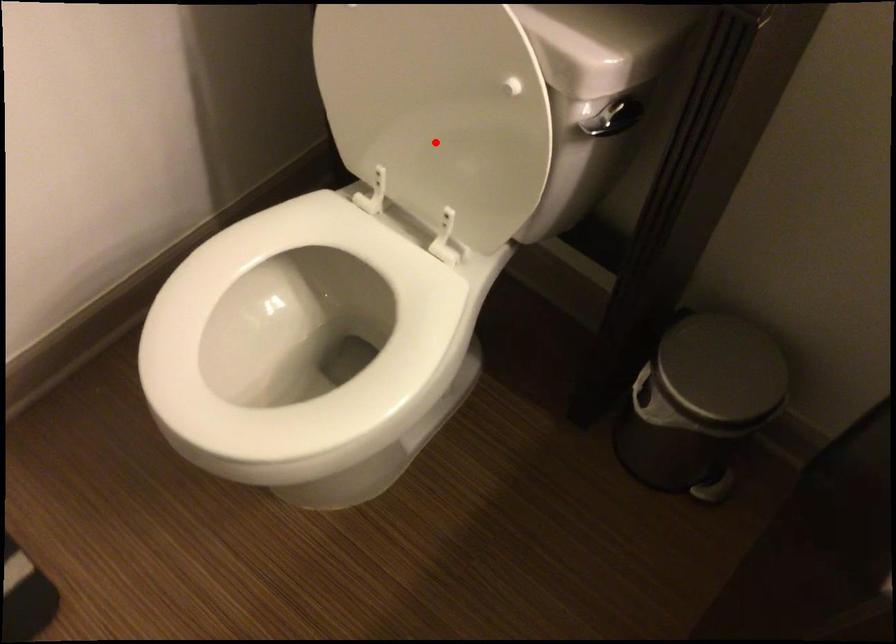
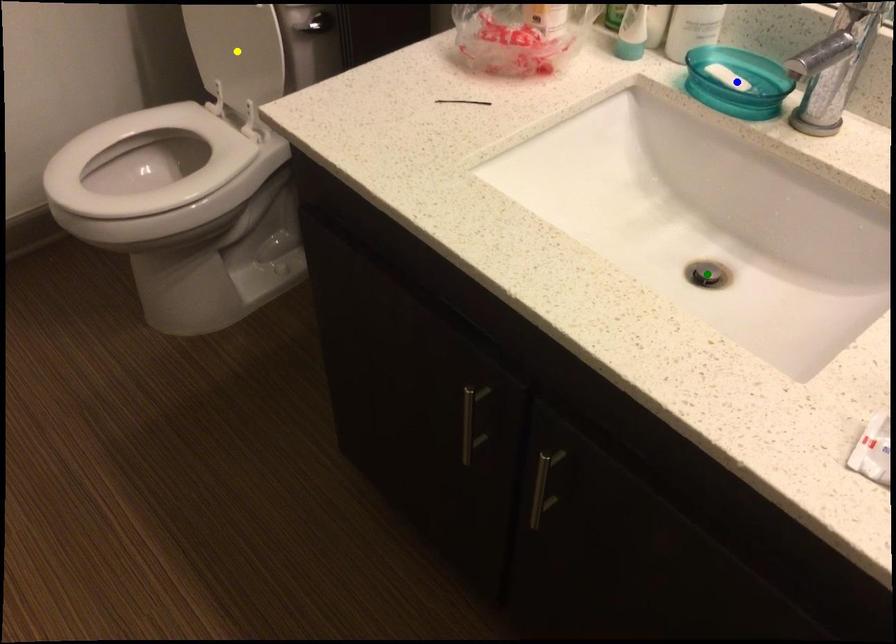
Question: I am providing you with two images of the same scene from different viewpoints. A red point is marked on the first image. You are given multiple points on the second image. Can you choose the point in image 2 that corresponds to the point in image 1?

Choices:
 (A) yellow point
 (B) blue point
 (C) green point

Answer: (A)